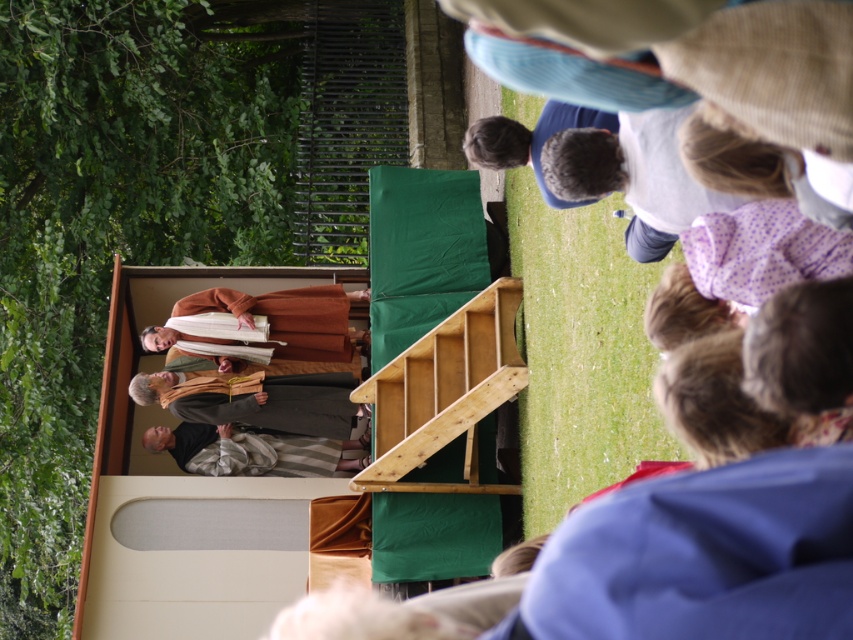
Question: Does light brown wooden stairs at center appear on the right side of smooth gray robe at center?

Choices:
 (A) no
 (B) yes

Answer: (B)

Question: Is light brown wooden stairs at center wider than striped fabric at center?

Choices:
 (A) yes
 (B) no

Answer: (B)

Question: Does smooth gray robe at center come in front of striped fabric at center?

Choices:
 (A) yes
 (B) no

Answer: (A)

Question: Which is farther from the striped fabric at center?

Choices:
 (A) smooth gray robe at center
 (B) light brown wooden stairs at center

Answer: (B)

Question: Which point appears farthest from the camera in this image?

Choices:
 (A) (196, 444)
 (B) (267, 417)
 (C) (401, 486)

Answer: (A)

Question: Estimate the real-world distances between objects in this image. Which object is closer to the striped fabric at center?

Choices:
 (A) light brown wooden stairs at center
 (B) smooth gray robe at center

Answer: (B)